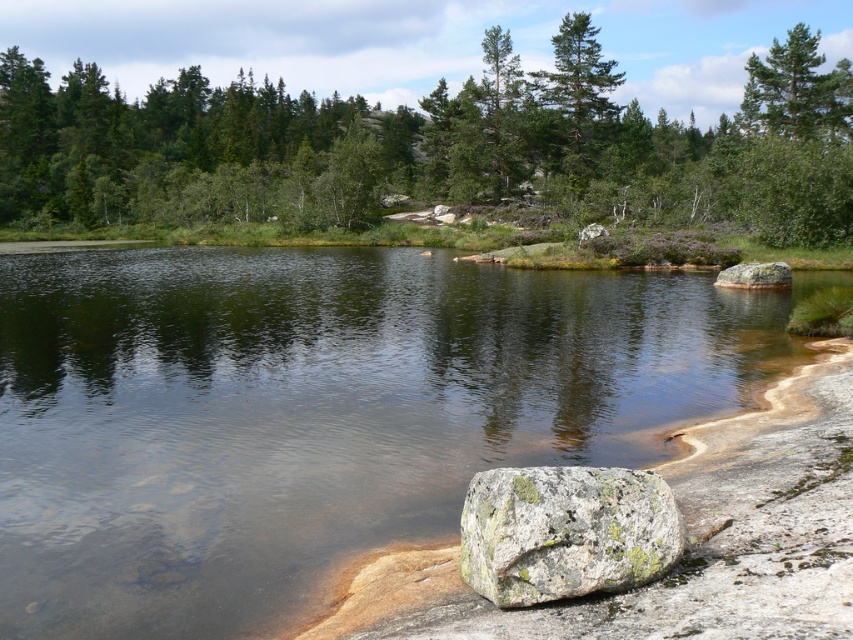
You are standing on the shoreline and looking towards the green leafy trees at upper center and the green textured pine tree at upper right. Which tree appears closer to you?

The green leafy trees at upper center appears closer because it is positioned over the green textured pine tree at upper right, which is further away.

You are standing at the center of the scene and want to locate the green leafy trees at upper center. Which direction should you look to find them?

You should look towards the upper center direction to find the green leafy trees at upper center as they are located at point (433, 147).